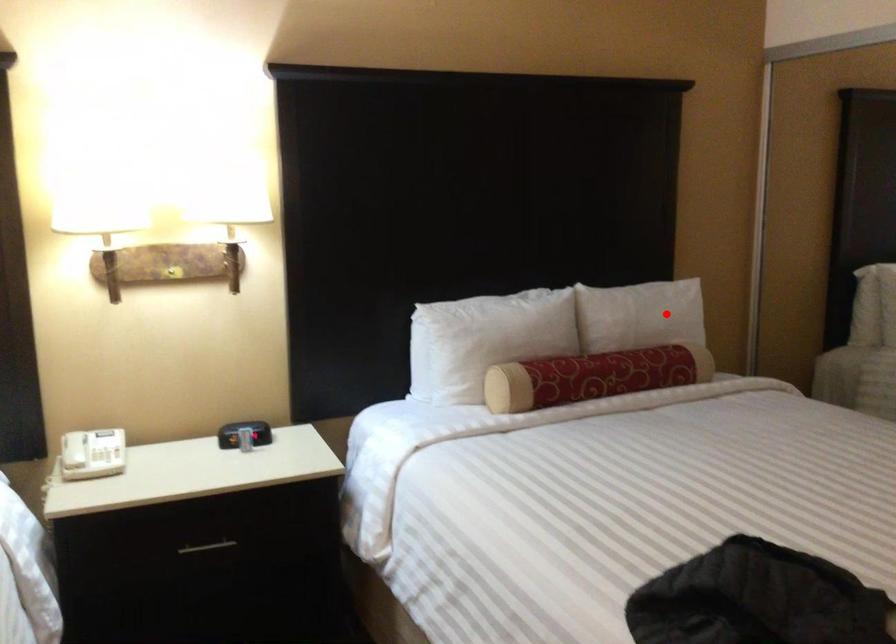
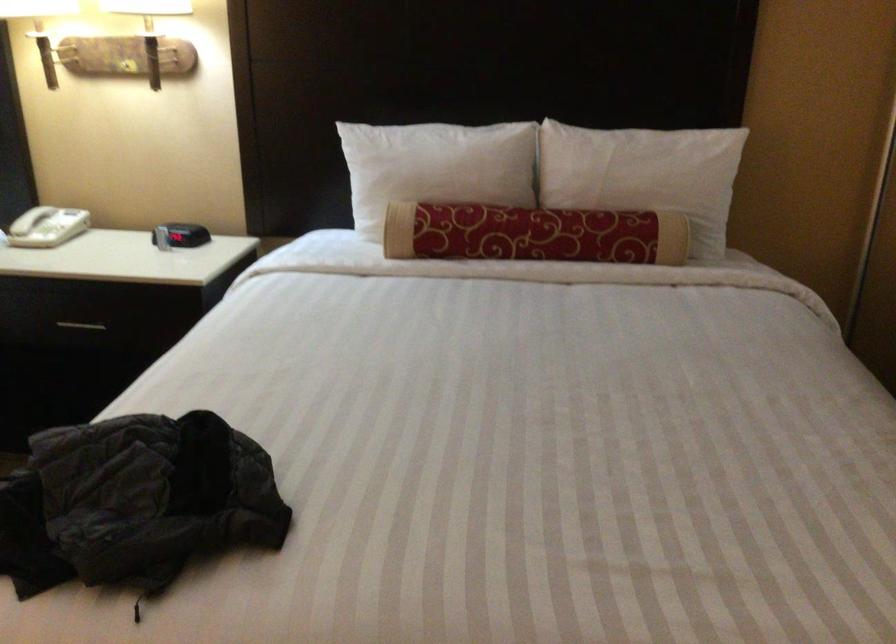
Where in the second image is the point corresponding to the highlighted location from the first image?

(643, 174)